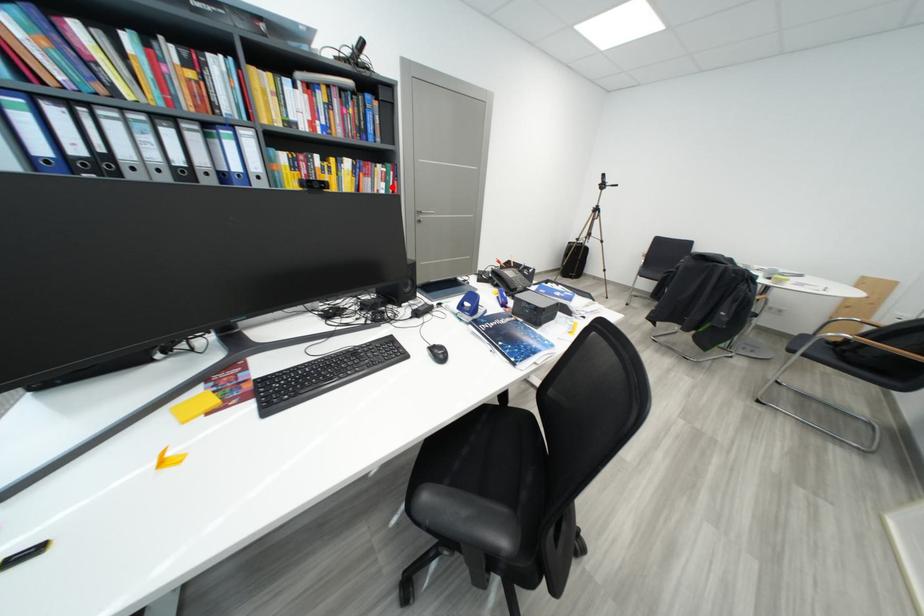
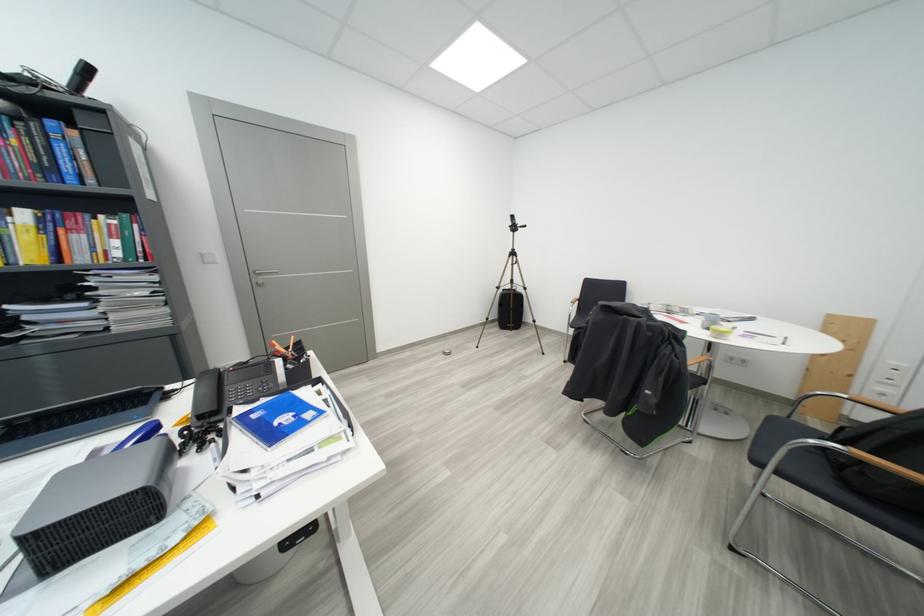
Question: I am providing you with two images of the same scene from different viewpoints. A red point is shown in image1. For the corresponding object point in image2, is it positioned nearer or farther from the camera?

Choices:
 (A) Nearer
 (B) Farther

Answer: (B)